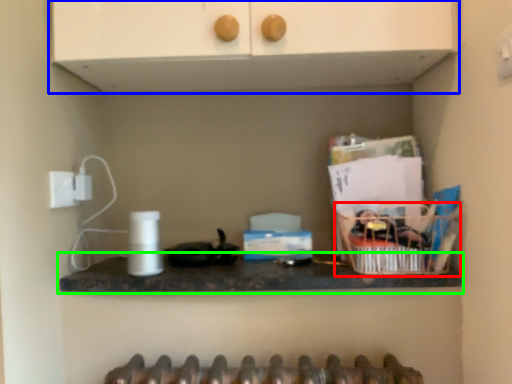
Question: Considering the real-world distances, which object is farthest from basket (highlighted by a red box)? cabinetry (highlighted by a blue box) or countertop (highlighted by a green box)?

Choices:
 (A) cabinetry
 (B) countertop

Answer: (A)